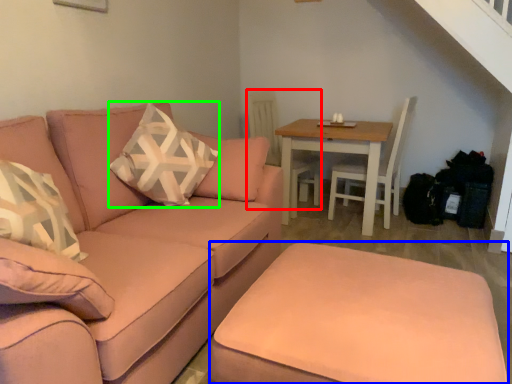
Question: Which object is the farthest from swivel chair (highlighted by a red box)? Choose among these: footrest (highlighted by a blue box) or throw pillow (highlighted by a green box).

Choices:
 (A) footrest
 (B) throw pillow

Answer: (A)